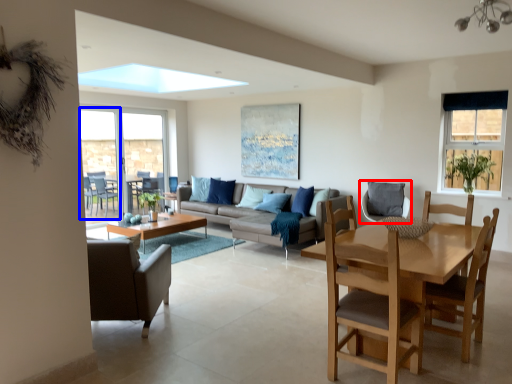
Question: Which of the following is the closest to the observer, chair (highlighted by a red box) or screen door (highlighted by a blue box)?

Choices:
 (A) chair
 (B) screen door

Answer: (A)